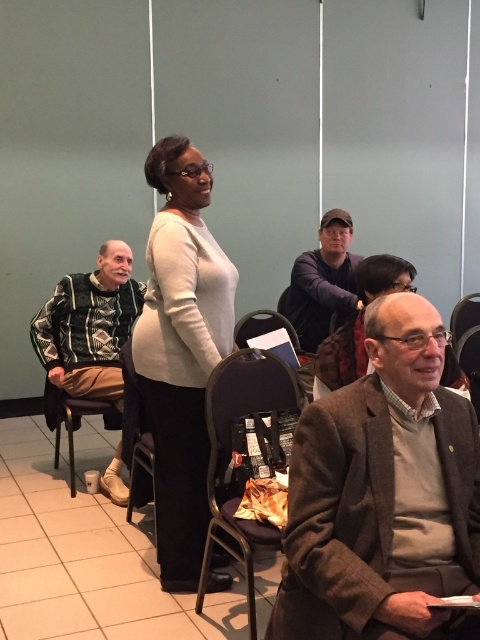
Question: Estimate the real-world distances between objects in this image. Which object is closer to the dark blue sweater at center?

Choices:
 (A) white matte sweater at center
 (B) knitted sweater at left

Answer: (B)

Question: Which point is farther to the camera?

Choices:
 (A) black fabric chair at lower center
 (B) white plastic chair at lower left
 (C) matte white shirt at center
 (D) brown woolen jacket at lower right

Answer: (B)

Question: Is matte white shirt at center to the left of white plastic chair at lower left from the viewer's perspective?

Choices:
 (A) yes
 (B) no

Answer: (B)

Question: Is brown woolen jacket at lower right thinner than black fabric chair at center?

Choices:
 (A) yes
 (B) no

Answer: (B)

Question: Where is knitted sweater at left located in relation to white plastic chair at lower left in the image?

Choices:
 (A) above
 (B) below

Answer: (A)

Question: Which point is farther to the camera?

Choices:
 (A) (300, 410)
 (B) (67, 397)
 (C) (84, 278)
 (D) (432, 348)

Answer: (C)